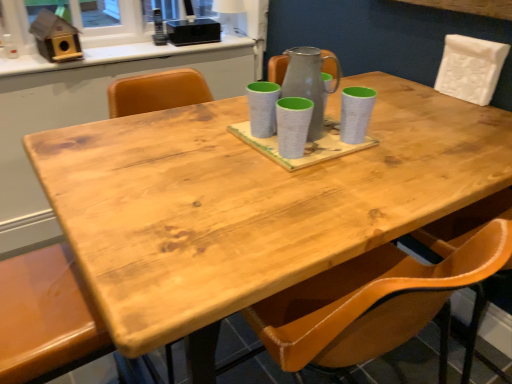
Where is `free space above matte brown chair at lower left, which appears as the first chair when ordered from the bottom (from a real-world perspective)`? free space above matte brown chair at lower left, which appears as the first chair when ordered from the bottom (from a real-world perspective) is located at coordinates (40, 292).